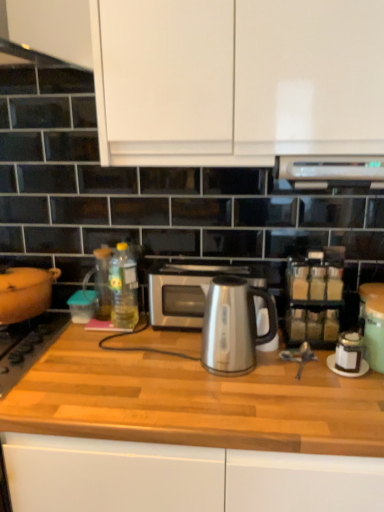
Image resolution: width=384 pixels, height=512 pixels. Describe the element at coordinates (233, 326) in the screenshot. I see `satin silver kettle at center` at that location.

The height and width of the screenshot is (512, 384). Describe the element at coordinates (314, 298) in the screenshot. I see `translucent glass spice rack at right` at that location.

At what (x,y) coordinates should I click in order to perform the action: click on transparent glass bottle at center, which ranks as the first bottle in left-to-right order. Please return your answer as a coordinate pair (x, y). This screenshot has width=384, height=512. Looking at the image, I should click on (103, 282).

Locate an element on the screen. translucent yellow bottle at center, marked as the first bottle in a right-to-left arrangement is located at coordinates (123, 288).

Describe the element at coordinates (28, 346) in the screenshot. I see `black glass gas stove at left` at that location.

The height and width of the screenshot is (512, 384). Find the location of `white matte cabinet at upper center`. white matte cabinet at upper center is located at coordinates (237, 80).

Consider the image. Does satin silver kettle at center lie in front of translucent yellow bottle at center, marked as the first bottle in a right-to-left arrangement?

Yes, satin silver kettle at center is closer to the camera.

Considering the points (242, 320) and (121, 278), which point is in front, point (242, 320) or point (121, 278)?

Positioned in front is point (242, 320).

How different are the orientations of satin silver kettle at center and translucent yellow bottle at center, which appears as the second bottle when viewed from the left, in degrees?

0.242 degrees.

Can you confirm if satin silver kettle at center is smaller than translucent yellow bottle at center, which appears as the second bottle when viewed from the left?

No.

Relative to translucent glass spice rack at right, is satin silver kettle at center in front or behind?

Clearly, satin silver kettle at center is in front of translucent glass spice rack at right.

Is point (226, 289) behind point (322, 289)?

That is False.

Between satin silver kettle at center and translucent glass spice rack at right, which one has less height?

satin silver kettle at center is shorter.

In the scene shown: From the image's perspective, between black glass gas stove at left and satin silver microwave at center, who is located below?

black glass gas stove at left is shown below in the image.

Can you confirm if black glass gas stove at left is shorter than satin silver microwave at center?

Correct, black glass gas stove at left is not as tall as satin silver microwave at center.

Considering the positions of objects black glass gas stove at left and satin silver microwave at center in the image provided, who is in front, black glass gas stove at left or satin silver microwave at center?

black glass gas stove at left.

Which object is further away from the camera, satin silver microwave at center or white matte cabinet at upper center?

Positioned behind is satin silver microwave at center.

Does point (234, 273) come farther from viewer compared to point (348, 133)?

Yes.

Based on their positions, is satin silver microwave at center located to the left or right of white matte cabinet at upper center?

Clearly, satin silver microwave at center is on the left of white matte cabinet at upper center in the image.

Which object is thinner, satin silver microwave at center or white matte cabinet at upper center?

satin silver microwave at center is thinner.

Is matte orange pot at left far away from white matte cabinet at upper center?

They are positioned close to each other.

Where is `cabinetry on the right of matte orange pot at left`? cabinetry on the right of matte orange pot at left is located at coordinates (237, 80).

Does matte orange pot at left have a lesser width compared to white matte cabinet at upper center?

Yes, matte orange pot at left is thinner than white matte cabinet at upper center.

From the image's perspective, is matte orange pot at left above or below white matte cabinet at upper center?

matte orange pot at left is below white matte cabinet at upper center.

Is translucent yellow bottle at center, which appears as the second bottle when viewed from the left, surrounding black glass gas stove at left?

No, black glass gas stove at left is not a part of translucent yellow bottle at center, which appears as the second bottle when viewed from the left.

Is translucent yellow bottle at center, marked as the first bottle in a right-to-left arrangement, wider than black glass gas stove at left?

Incorrect, the width of translucent yellow bottle at center, marked as the first bottle in a right-to-left arrangement, does not surpass that of black glass gas stove at left.

Could you tell me if translucent yellow bottle at center, marked as the first bottle in a right-to-left arrangement, is facing black glass gas stove at left?

No, translucent yellow bottle at center, marked as the first bottle in a right-to-left arrangement, is not aimed at black glass gas stove at left.

From the picture: From a real-world perspective, is translucent yellow bottle at center, marked as the first bottle in a right-to-left arrangement, on top of black glass gas stove at left?

Yes.

Which of these two, translucent glass spice rack at right or translucent yellow bottle at center, which appears as the second bottle when viewed from the left, stands shorter?

translucent yellow bottle at center, which appears as the second bottle when viewed from the left.

Is translucent glass spice rack at right with translucent yellow bottle at center, marked as the first bottle in a right-to-left arrangement?

There is a gap between translucent glass spice rack at right and translucent yellow bottle at center, marked as the first bottle in a right-to-left arrangement.

Considering the positions of objects translucent glass spice rack at right and translucent yellow bottle at center, marked as the first bottle in a right-to-left arrangement, in the image provided, who is more to the right, translucent glass spice rack at right or translucent yellow bottle at center, marked as the first bottle in a right-to-left arrangement,?

translucent glass spice rack at right.

Is the depth of translucent glass spice rack at right greater than that of translucent yellow bottle at center, marked as the first bottle in a right-to-left arrangement?

That is False.

Identify the location of coffeepot in front of the translucent yellow bottle at center, which appears as the second bottle when viewed from the left. (233, 326).

Find the location of a particular element. Image resolution: width=384 pixels, height=512 pixels. appliance on the right of satin silver kettle at center is located at coordinates (314, 298).

Which object lies further to the anchor point transparent glass bottle at center, placed as the 2th bottle when sorted from right to left, satin silver microwave at center or translucent yellow bottle at center, marked as the first bottle in a right-to-left arrangement?

satin silver microwave at center lies further to transparent glass bottle at center, placed as the 2th bottle when sorted from right to left, than the other object.

When comparing their distances from matte orange pot at left, does translucent glass spice rack at right or satin silver kettle at center seem closer?

satin silver kettle at center.

Which object lies nearer to the anchor point matte orange pot at left, transparent glass bottle at center, which ranks as the first bottle in left-to-right order, or black glass gas stove at left?

Based on the image, black glass gas stove at left appears to be nearer to matte orange pot at left.

From the image, which object appears to be farther from satin silver microwave at center, matte orange pot at left or transparent glass bottle at center, which ranks as the first bottle in left-to-right order?

The object further to satin silver microwave at center is matte orange pot at left.

Estimate the real-world distances between objects in this image. Which object is further from black glass gas stove at left, matte orange pot at left or transparent glass bottle at center, placed as the 2th bottle when sorted from right to left?

Based on the image, transparent glass bottle at center, placed as the 2th bottle when sorted from right to left, appears to be further to black glass gas stove at left.

Based on their spatial positions, is white matte cabinet at upper center or satin silver kettle at center further from matte orange pot at left?

white matte cabinet at upper center is positioned further to the anchor matte orange pot at left.

Which object lies nearer to the anchor point matte orange pot at left, black glass gas stove at left or translucent yellow bottle at center, marked as the first bottle in a right-to-left arrangement?

The object closer to matte orange pot at left is black glass gas stove at left.

When comparing their distances from translucent yellow bottle at center, marked as the first bottle in a right-to-left arrangement, does matte orange pot at left or transparent glass bottle at center, which ranks as the first bottle in left-to-right order, seem closer?

transparent glass bottle at center, which ranks as the first bottle in left-to-right order.

At what (x,y) coordinates should I click in order to perform the action: click on bottle between black glass gas stove at left and transparent glass bottle at center, placed as the 2th bottle when sorted from right to left, in the front-back direction. Please return your answer as a coordinate pair (x, y). Looking at the image, I should click on (123, 288).

You are a GUI agent. You are given a task and a screenshot of the screen. Output one action in this format:
    pyautogui.click(x=<x>, y=<y>)
    Task: Click on the microwave oven between black glass gas stove at left and translucent glass spice rack at right in the horizontal direction
    The height and width of the screenshot is (512, 384).
    Given the screenshot: What is the action you would take?
    pyautogui.click(x=183, y=292)

You are a GUI agent. You are given a task and a screenshot of the screen. Output one action in this format:
    pyautogui.click(x=<x>, y=<y>)
    Task: Click on the cabinetry between black glass gas stove at left and translucent glass spice rack at right
    This screenshot has width=384, height=512.
    Given the screenshot: What is the action you would take?
    pyautogui.click(x=237, y=80)

Find the location of a particular element. Image resolution: width=384 pixels, height=512 pixels. appliance between white matte cabinet at upper center and satin silver kettle at center in the vertical direction is located at coordinates (314, 298).